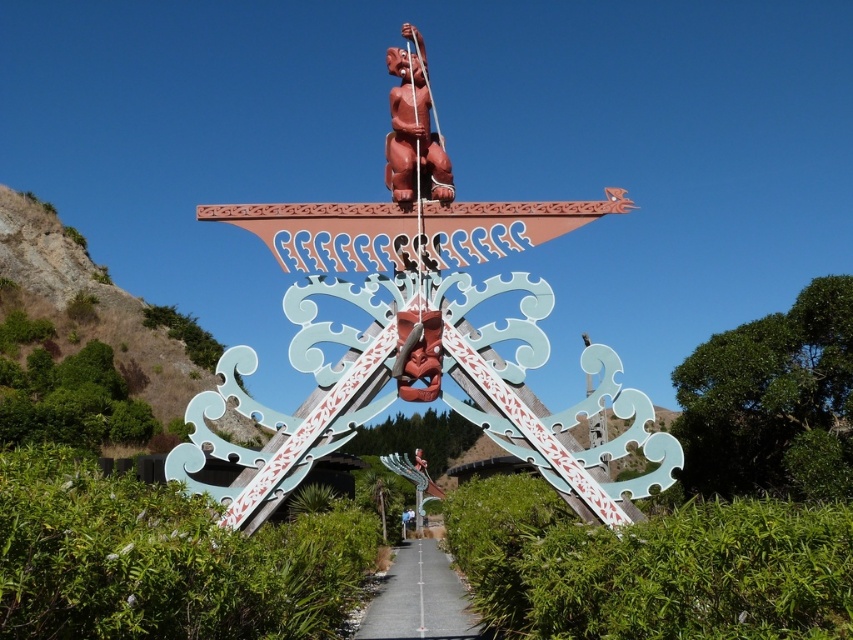
You are standing at the entrance of the cultural gateway and want to walk towards the gray concrete path at center. Is there enough space to walk around the green leafy hedge at lower center?

The green leafy hedge at lower center might be wider than the gray concrete path at center, so there might not be enough space to walk around it. You should check the width before proceeding.

You are standing at the entrance of this cultural gateway and want to walk towards the gray concrete path at center. However, there is a green leafy hedge at lower center blocking your way. Can you walk around it? Explain why.

The green leafy hedge at lower center is bigger than the gray concrete path at center, so it might block the path. To walk around it, you would need to go either to the left or right side of the green leafy hedge at lower center since the hedge is larger in size than the path itself.